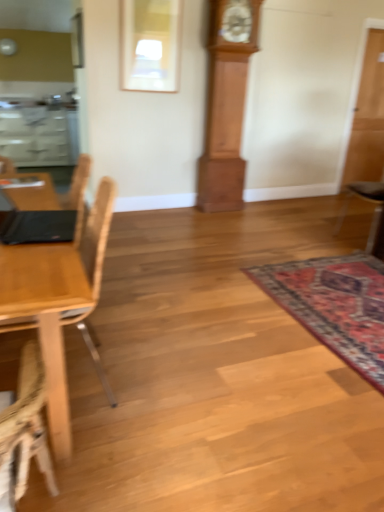
Find the location of `spots to the right of light wood chair at left, which appears as the second chair when viewed from the back`. spots to the right of light wood chair at left, which appears as the second chair when viewed from the back is located at coordinates (173, 387).